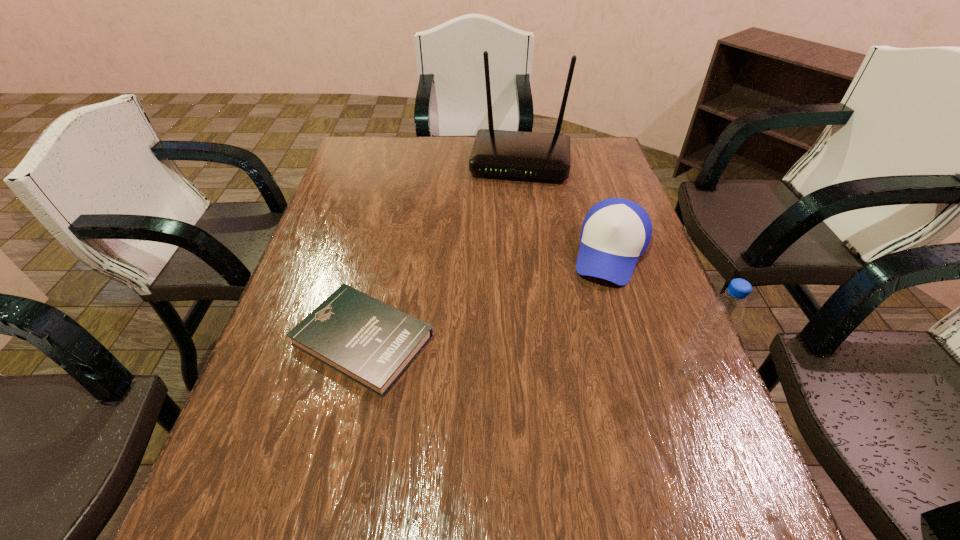
At what (x,y) coordinates should I click in order to perform the action: click on the leftmost object. Please return your answer as a coordinate pair (x, y). The height and width of the screenshot is (540, 960). Looking at the image, I should click on (372, 343).

Locate an element on the screen. This screenshot has width=960, height=540. the shortest object is located at coordinates (372, 343).

Image resolution: width=960 pixels, height=540 pixels. I want to click on water bottle, so (x=724, y=315).

Image resolution: width=960 pixels, height=540 pixels. I want to click on the second shortest object, so click(615, 233).

Image resolution: width=960 pixels, height=540 pixels. I want to click on baseball cap, so click(x=615, y=233).

You are a GUI agent. You are given a task and a screenshot of the screen. Output one action in this format:
    pyautogui.click(x=<x>, y=<y>)
    Task: Click on the tallest object
    
    Given the screenshot: What is the action you would take?
    pyautogui.click(x=533, y=155)

Where is `the farthest object`? the farthest object is located at coordinates (533, 155).

At what (x,y) coordinates should I click in order to perform the action: click on vacant space situated 0.350m on the back of the leftmost object. Please return your answer as a coordinate pair (x, y). This screenshot has height=540, width=960. Looking at the image, I should click on (394, 207).

Where is `vacant area situated 0.260m on the back of the water bottle`? This screenshot has width=960, height=540. vacant area situated 0.260m on the back of the water bottle is located at coordinates click(653, 271).

Identify the location of free location located 0.070m on the front-facing side of the third tallest object. (596, 305).